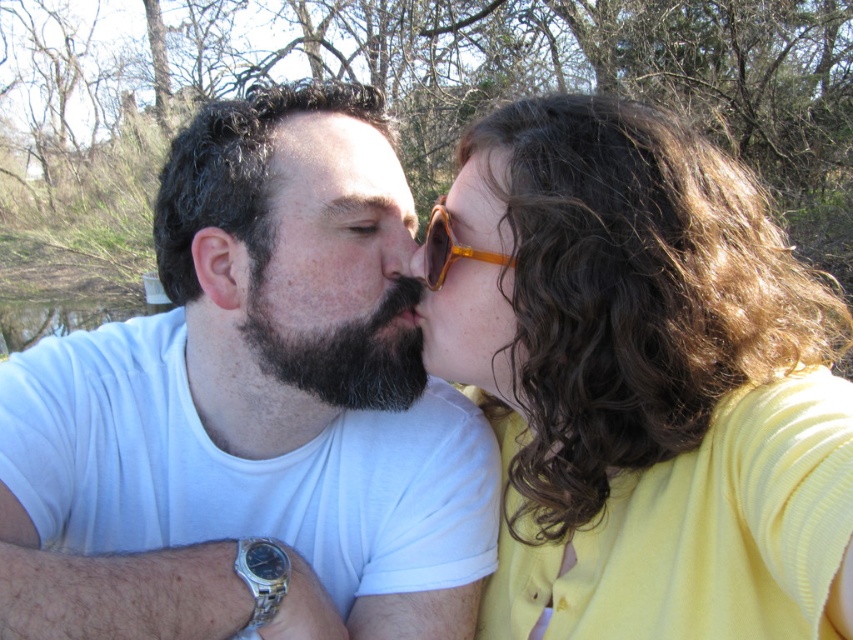
Question: Where is bearded man at center located in relation to translucent amber sunglasses at center in the image?

Choices:
 (A) left
 (B) right

Answer: (A)

Question: Which object appears closest to the camera in this image?

Choices:
 (A) matte yellow sweater at center
 (B) matte skin forehead at center
 (C) bearded man at center
 (D) translucent amber sunglasses at center

Answer: (A)

Question: In this image, where is bearded man at center located relative to matte brown nose at center?

Choices:
 (A) left
 (B) right

Answer: (A)

Question: Estimate the real-world distances between objects in this image. Which object is farther from the bearded man at center?

Choices:
 (A) matte brown nose at center
 (B) dark brown fuzzy beard at center
 (C) translucent amber sunglasses at center
 (D) matte yellow sweater at center

Answer: (D)

Question: Does dark brown fuzzy beard at center have a greater width compared to matte skin forehead at center?

Choices:
 (A) no
 (B) yes

Answer: (B)

Question: Estimate the real-world distances between objects in this image. Which object is closer to the bearded man at center?

Choices:
 (A) matte yellow sweater at center
 (B) translucent amber sunglasses at center
 (C) matte brown nose at center
 (D) white matte t-shirt at center

Answer: (D)